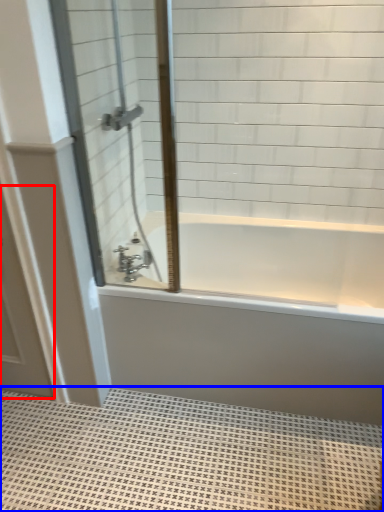
Question: Which object appears farthest to the camera in this image, screen door (highlighted by a red box) or bath mat (highlighted by a blue box)?

Choices:
 (A) screen door
 (B) bath mat

Answer: (A)